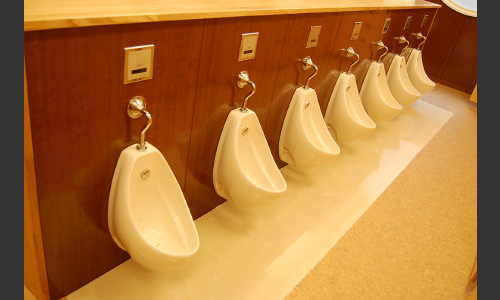
I want to click on urinals, so click(x=144, y=192), click(x=242, y=152), click(x=314, y=128), click(x=351, y=102), click(x=380, y=90), click(x=402, y=81), click(x=418, y=70).